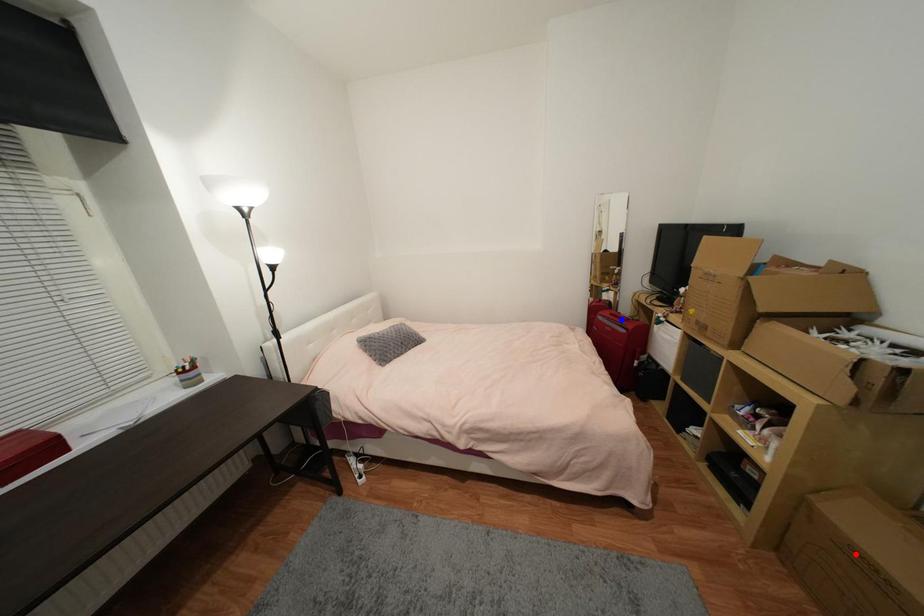
Question: Two points are marked on the image. Which point is closer to the camera?

Choices:
 (A) Blue point is closer.
 (B) Red point is closer.

Answer: (B)